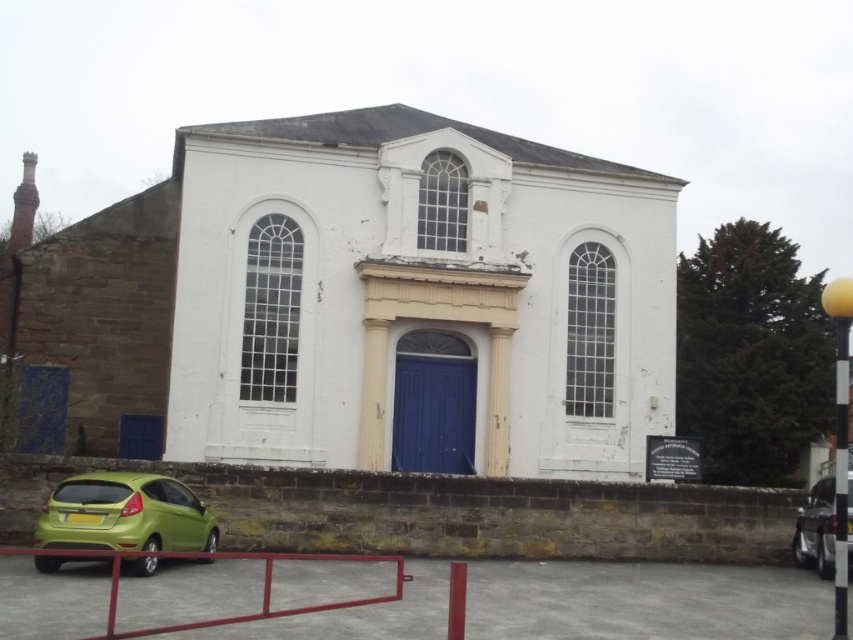
You are standing at the entrance of the white painted wood chapel at center. What are the coordinates of your current position?

The coordinates of your current position at the entrance of the white painted wood chapel at center are at point (x=363, y=298).

You are standing in front of the building and want to determine the relative positions of two points marked on the facade. Which point is closer to you, point 1 at coordinates (374, 144) or point 2 at coordinates (73, 509)?

Point 1 at coordinates (374, 144) is closer to you because it is further to the viewer than point 2 at coordinates (73, 509).